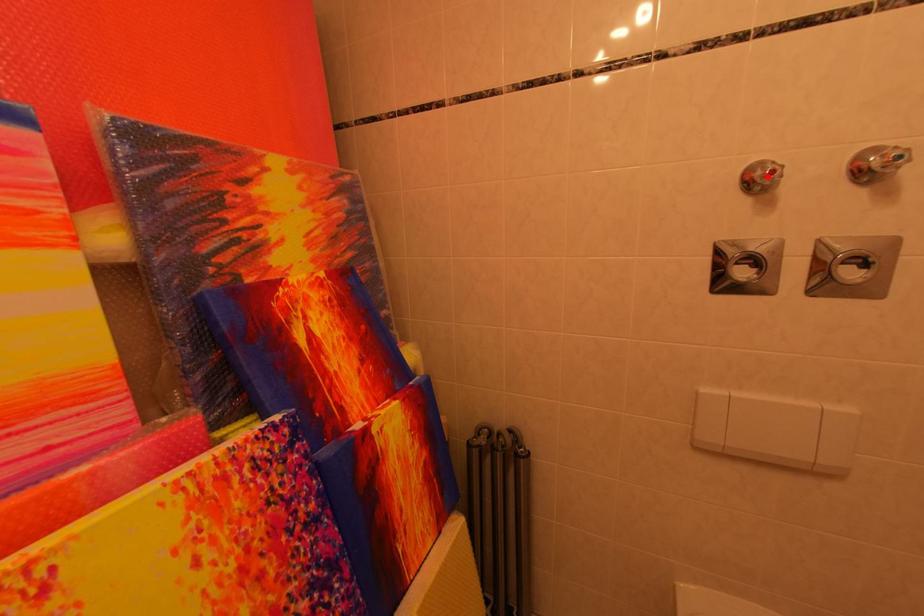
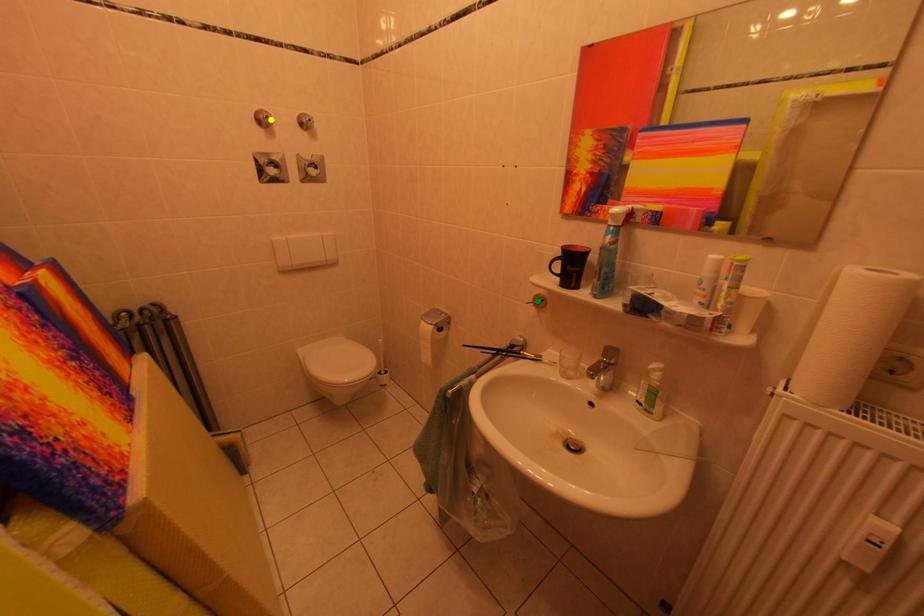
Question: I am providing you with two images of the same scene from different viewpoints. A red point is marked on the first image. You are given multiple points on the second image. In image 2, which mark is for the same physical point as the one in image 1?

Choices:
 (A) blue point
 (B) yellow point
 (C) green point

Answer: (B)